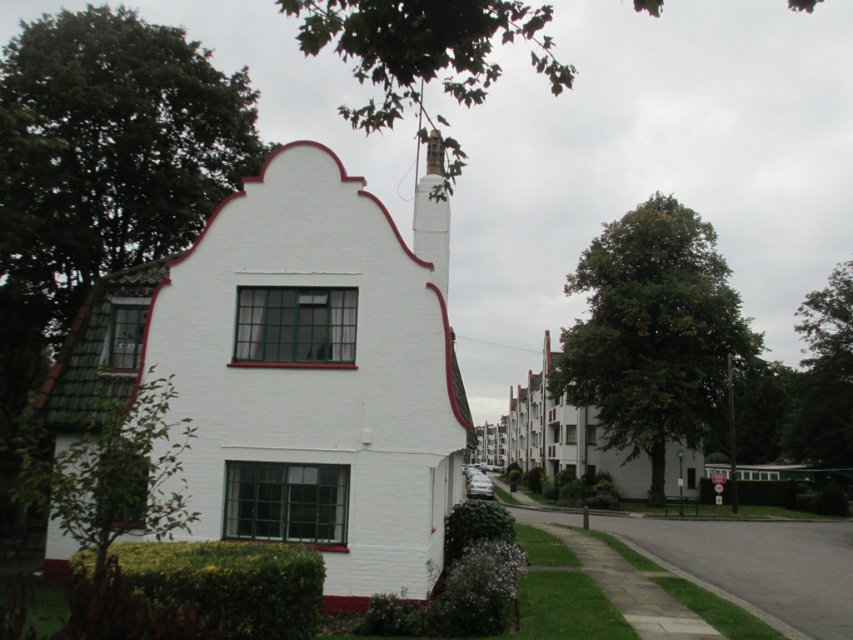
Question: Which point is farther to the camera?

Choices:
 (A) white painted brick chimney at center
 (B) smooth gray chimney at center

Answer: (A)

Question: Considering the relative positions of white painted brick chimney at center and smooth gray chimney at center in the image provided, where is white painted brick chimney at center located with respect to smooth gray chimney at center?

Choices:
 (A) below
 (B) above

Answer: (A)

Question: Considering the relative positions of white painted brick chimney at center and smooth gray chimney at center in the image provided, where is white painted brick chimney at center located with respect to smooth gray chimney at center?

Choices:
 (A) below
 (B) above

Answer: (A)

Question: From the image, what is the correct spatial relationship of white painted brick chimney at center in relation to smooth gray chimney at center?

Choices:
 (A) right
 (B) left

Answer: (B)